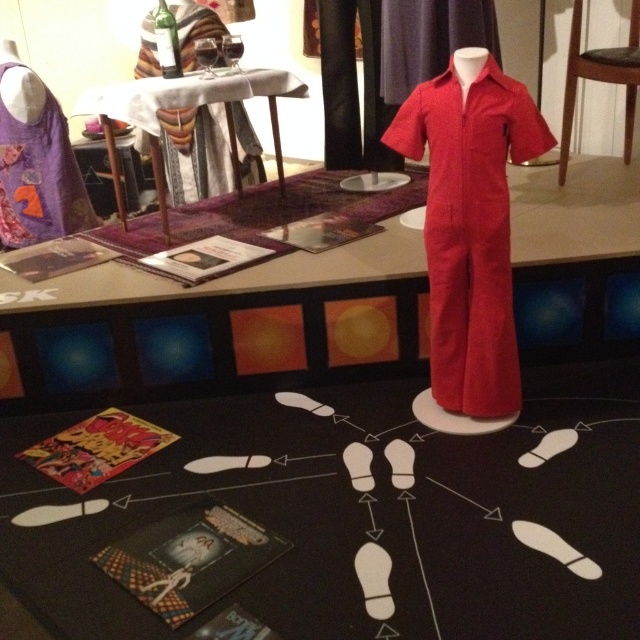
Question: Which point is farther to the camera?

Choices:
 (A) (515, 396)
 (B) (24, 163)
 (C) (113, 307)

Answer: (B)

Question: Is purple cotton dress at upper left bigger than matte red jumpsuit at upper center?

Choices:
 (A) no
 (B) yes

Answer: (A)

Question: Does corduroy jumpsuit at center have a lesser width compared to matte red jumpsuit at upper center?

Choices:
 (A) no
 (B) yes

Answer: (B)

Question: Which point is closer to the camera?

Choices:
 (A) (112, 90)
 (B) (433, 388)

Answer: (B)

Question: Which point is closer to the camera?

Choices:
 (A) (464, 214)
 (B) (273, 83)
 (C) (33, 131)
 (D) (200, 122)

Answer: (A)

Question: Is matte wood table at center below purple cotton dress at upper left?

Choices:
 (A) no
 (B) yes

Answer: (B)